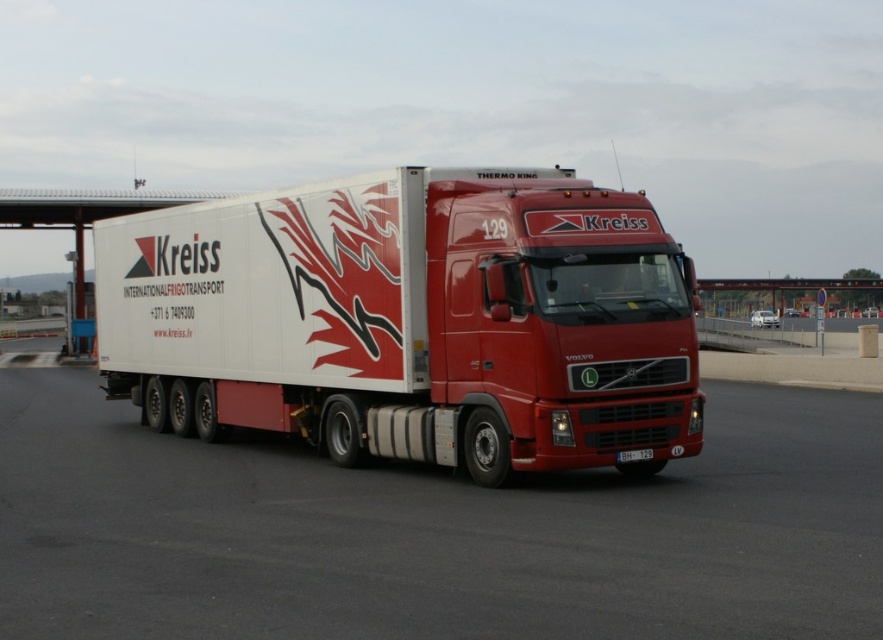
You are standing at the logistics hub and want to take a photo of the white glossy truck at center. If your camera can focus on objects up to 5 meters away, will you need to move closer or farther away to capture a clear photo?

The white glossy truck at center is 5.42 meters from viewer. Since the camera can focus up to 5 meters, you need to move closer to ensure the truck is within the camera range.

You are a delivery driver who needs to park your white glossy truck at center and white glossy trailer at center in a tight parking lot. Based on the scene, which one will require more space to park?

The white glossy trailer at center requires more space to park because it occupies more space than the white glossy truck at center according to the description.